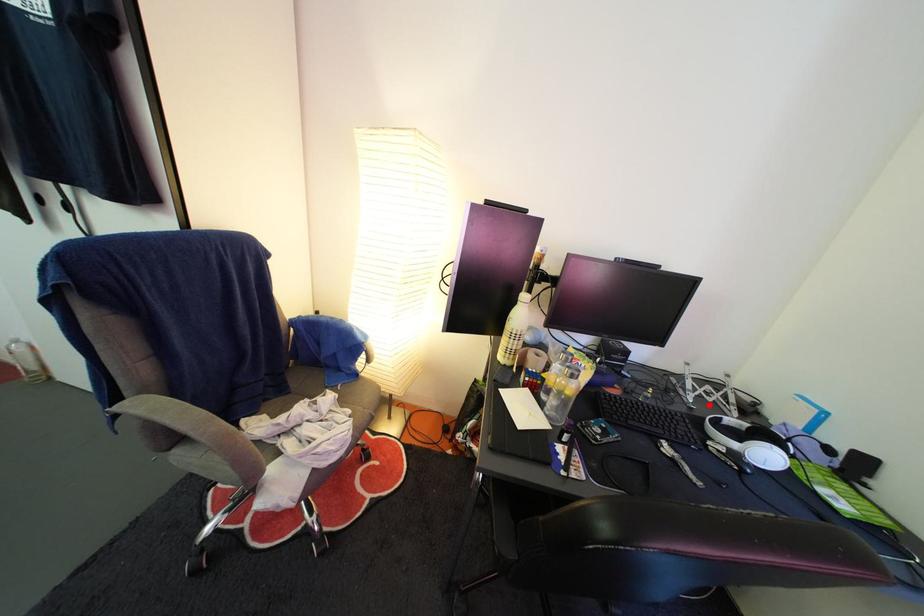
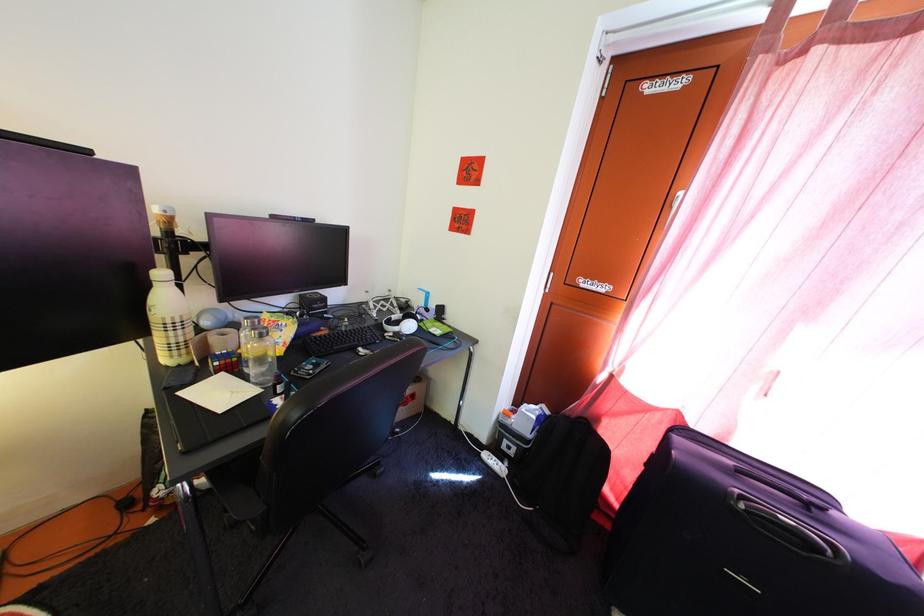
Locate, in the second image, the point that corresponds to the highlighted location in the first image.

(388, 318)